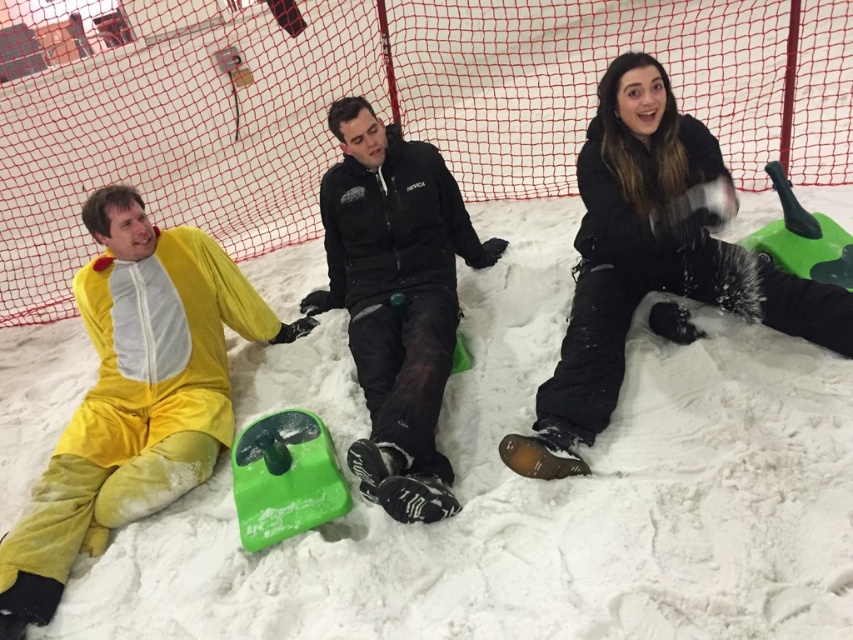
Is the position of white fluffy snow at center less distant than that of net at center?

Yes, it is in front of net at center.

Does white fluffy snow at center lie behind net at center?

That is False.

Is point (641, 348) positioned after point (756, 76)?

No, (641, 348) is in front of (756, 76).

Find the location of a particular element. Image resolution: width=853 pixels, height=640 pixels. white fluffy snow at center is located at coordinates pos(526,490).

Consider the image. Is yellow plush onesie at left bigger than matte black jacket at upper right?

Correct, yellow plush onesie at left is larger in size than matte black jacket at upper right.

Who is shorter, yellow plush onesie at left or matte black jacket at upper right?

Standing shorter between the two is matte black jacket at upper right.

Is point (111, 220) positioned in front of point (642, 97)?

No.

Where is `yellow plush onesie at left`? yellow plush onesie at left is located at coordinates (134, 396).

Is white fluffy snow at center bigger than yellow plush onesie at left?

Correct, white fluffy snow at center is larger in size than yellow plush onesie at left.

Between white fluffy snow at center and yellow plush onesie at left, which one is positioned lower?

yellow plush onesie at left is lower down.

The height and width of the screenshot is (640, 853). Identify the location of white fluffy snow at center. (526, 490).

At what (x,y) coordinates should I click in order to perform the action: click on white fluffy snow at center. Please return your answer as a coordinate pair (x, y). Image resolution: width=853 pixels, height=640 pixels. Looking at the image, I should click on point(526,490).